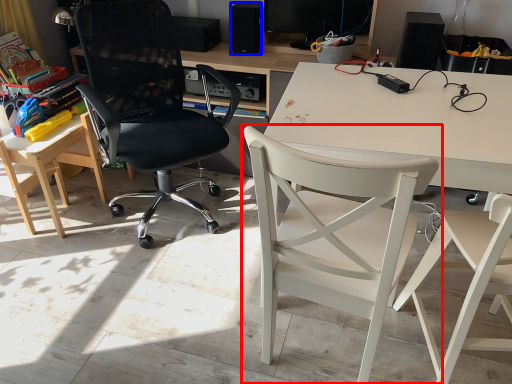
Question: Which object is further to the camera taking this photo, chair (highlighted by a red box) or loudspeaker (highlighted by a blue box)?

Choices:
 (A) chair
 (B) loudspeaker

Answer: (B)